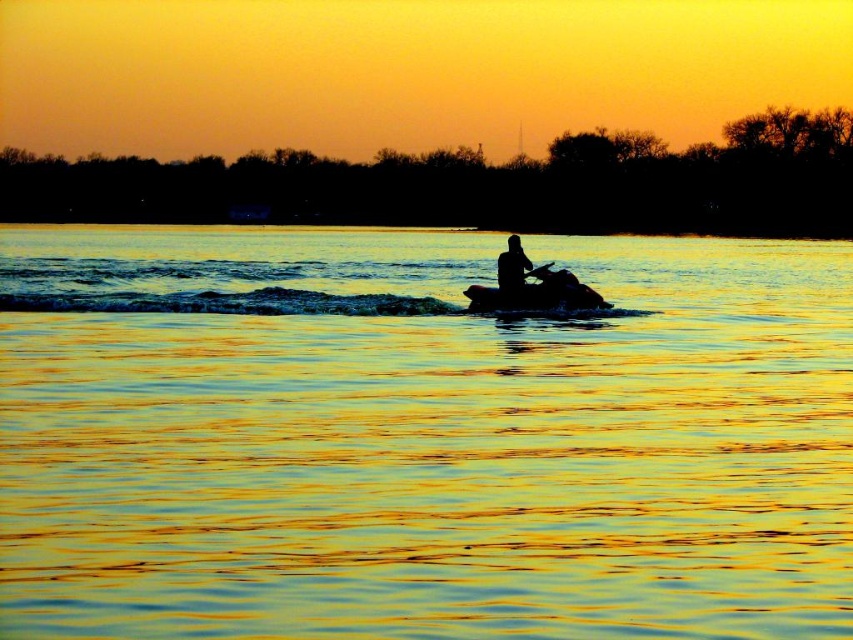
You are standing on the shore looking at the golden reflective water at center and the silhouette jet ski at center. Which object is closer to you?

The golden reflective water at center is closer to the viewer than the silhouette jet ski at center.

In the scene shown: You are a photographer trying to capture the sunset reflection on the water. You notice the golden reflective water at center and the silhouette jet ski at center in your viewfinder. Which object is positioned to the left of the other?

The golden reflective water at center is to the left of the silhouette jet ski at center.

You are standing at the point with coordinates point (537, 296). What object is located at your current position?

The silhouette jet ski at center is located at point (537, 296).